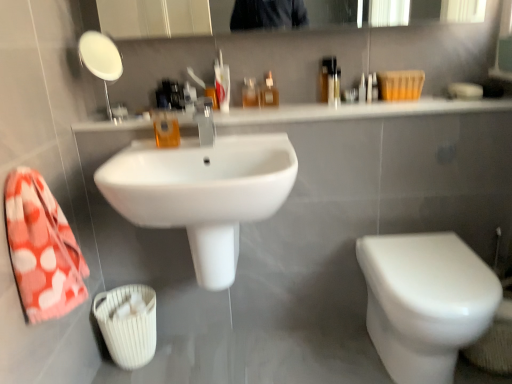
Question: From the image's perspective, is white glossy toilet at lower right positioned above or below white glossy sink at upper center?

Choices:
 (A) above
 (B) below

Answer: (B)

Question: Is white glossy toilet at lower right to the left or to the right of white glossy sink at upper center in the image?

Choices:
 (A) left
 (B) right

Answer: (B)

Question: Which of these objects is positioned farthest from the translucent plastic bottle at upper center, which ranks as the 2th mouthwash in back-to-front order?

Choices:
 (A) translucent plastic mouthwash at center, arranged as the 1th mouthwash when viewed from the front
 (B) orange polka dot towel at left
 (C) white glossy sink at upper center
 (D) translucent plastic bottle at center, which ranks as the 3th mouthwash in front-to-back order
 (E) white glossy mirror at upper left

Answer: (B)

Question: Estimate the real-world distances between objects in this image. Which object is closer to the translucent plastic mouthwash at center, the third mouthwash in the right-to-left sequence?

Choices:
 (A) satin nickel faucet at center
 (B) white glossy sink at upper center
 (C) white glossy sink at center
 (D) translucent plastic bottle at upper center, which ranks as the 2th mouthwash in back-to-front order
 (E) white glossy mirror at upper left

Answer: (A)